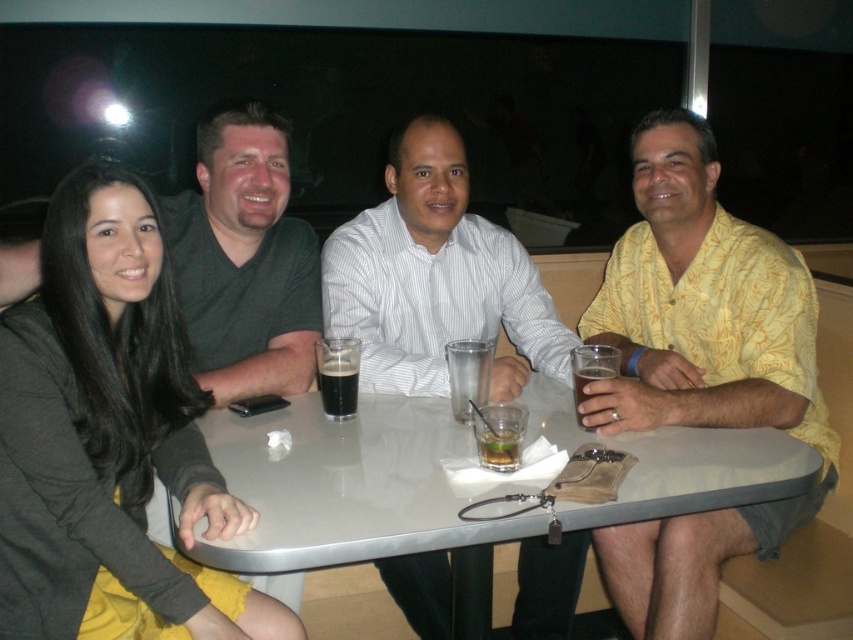
You are a waiter in a restaurant and you see the yellow printed shirt at right and the dark brown liquid at table center. Which one is closer to the ceiling?

The yellow printed shirt at right is above the dark brown liquid at table center, so it is closer to the ceiling.

You are a photographer standing in front of the group at the round table. You want to take a closeup shot of the white striped shirt at center without moving the subjects. Is the distance sufficient for a clear photo?

The white striped shirt at center is 1.68 meters away from the viewer. This distance is sufficient for a clear closeup photo as modern cameras can focus effectively at this range.

You are a waiter in a restaurant. You need to deliver a dessert to the table where the yellow printed shirt at right and dark brown liquid at table center are present. The dessert plate is quite large. Which object should you avoid placing the dessert near to prevent it from spilling?

You should avoid placing the dessert near the dark brown liquid at table center because it is smaller and more likely to spill if bumped. The yellow printed shirt at right is bigger and less likely to cause a spill if the dessert plate is placed nearby.